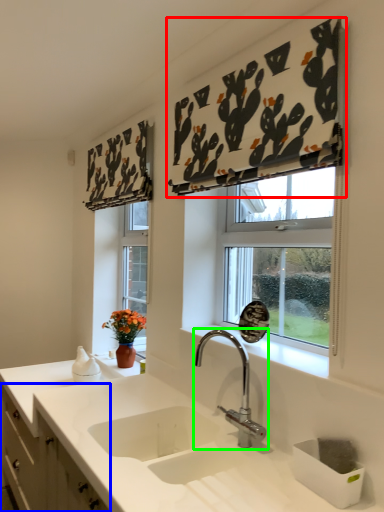
Question: Considering the real-world distances, which object is farthest from curtain (highlighted by a red box)? cabinetry (highlighted by a blue box) or tap (highlighted by a green box)?

Choices:
 (A) cabinetry
 (B) tap

Answer: (A)